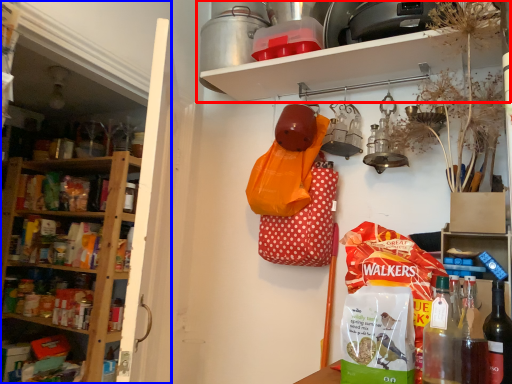
Question: Which object is closer to the camera taking this photo, shelf (highlighted by a red box) or shelf (highlighted by a blue box)?

Choices:
 (A) shelf
 (B) shelf

Answer: (B)